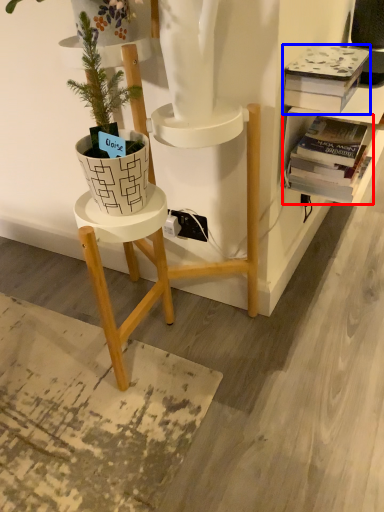
Question: Among these objects, which one is farthest to the camera, book (highlighted by a red box) or book (highlighted by a blue box)?

Choices:
 (A) book
 (B) book

Answer: (A)